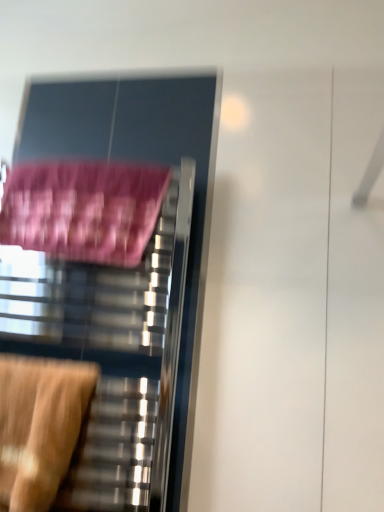
What do you see at coordinates (39, 426) in the screenshot? I see `wooden swivel chair at lower left` at bounding box center [39, 426].

Measure the distance between metallic towel rack at left and camera.

metallic towel rack at left and camera are 98.11 centimeters apart.

In order to click on pink fabric bath towel at left in this screenshot , I will do `click(83, 210)`.

Is wooden swivel chair at lower left not inside pink fabric bath towel at left?

Indeed, wooden swivel chair at lower left is completely outside pink fabric bath towel at left.

Based on the photo, from the image's perspective, is wooden swivel chair at lower left under pink fabric bath towel at left?

Yes.

Where is `bath towel located behind the wooden swivel chair at lower left`? This screenshot has width=384, height=512. bath towel located behind the wooden swivel chair at lower left is located at coordinates coord(83,210).

Considering the sizes of objects pink fabric bath towel at left and metallic towel rack at left in the image provided, who is shorter, pink fabric bath towel at left or metallic towel rack at left?

Standing shorter between the two is pink fabric bath towel at left.

Can you tell me how much pink fabric bath towel at left and metallic towel rack at left differ in facing direction?

pink fabric bath towel at left and metallic towel rack at left are facing 0.000149 degrees away from each other.

Is point (111, 224) in front of point (144, 425)?

Yes, point (111, 224) is in front of point (144, 425).

Based on the photo, is pink fabric bath towel at left in front of or behind metallic towel rack at left in the image?

pink fabric bath towel at left is positioned farther from the viewer than metallic towel rack at left.

How many degrees apart are the facing directions of metallic towel rack at left and pink fabric bath towel at left?

0.000149 degrees separate the facing orientations of metallic towel rack at left and pink fabric bath towel at left.

Based on the photo, considering the relative positions of metallic towel rack at left and pink fabric bath towel at left in the image provided, is metallic towel rack at left behind pink fabric bath towel at left?

No, it is in front of pink fabric bath towel at left.

From the image's perspective, who appears lower, metallic towel rack at left or pink fabric bath towel at left?

metallic towel rack at left is shown below in the image.

From a real-world perspective, is metallic towel rack at left physically above pink fabric bath towel at left?

→ No, from a real-world perspective, metallic towel rack at left is not above pink fabric bath towel at left.

Is wooden swivel chair at lower left oriented away from metallic towel rack at left?

Yes, wooden swivel chair at lower left's orientation is away from metallic towel rack at left.

From a real-world perspective, is wooden swivel chair at lower left over metallic towel rack at left?

No.

Looking at this image, would you say wooden swivel chair at lower left contains metallic towel rack at left?

No, wooden swivel chair at lower left does not contain metallic towel rack at left.

Which of these two, pink fabric bath towel at left or wooden swivel chair at lower left, stands shorter?

With less height is pink fabric bath towel at left.

Is pink fabric bath towel at left wider or thinner than wooden swivel chair at lower left?

pink fabric bath towel at left is thinner than wooden swivel chair at lower left.

Does pink fabric bath towel at left turn towards wooden swivel chair at lower left?

No, pink fabric bath towel at left does not turn towards wooden swivel chair at lower left.

Considering the positions of objects pink fabric bath towel at left and wooden swivel chair at lower left in the image provided, who is more to the left, pink fabric bath towel at left or wooden swivel chair at lower left?

From the viewer's perspective, wooden swivel chair at lower left appears more on the left side.

Identify the location of swivel chair that appears in front of the metallic towel rack at left. This screenshot has height=512, width=384. (39, 426).

Looking at this image, is metallic towel rack at left looking in the opposite direction of wooden swivel chair at lower left?

Correct, metallic towel rack at left is looking away from wooden swivel chair at lower left.

Are metallic towel rack at left and wooden swivel chair at lower left located far from each other?

No, metallic towel rack at left is not far from wooden swivel chair at lower left.

Considering the points (172, 335) and (50, 461), which point is behind, point (172, 335) or point (50, 461)?

Point (172, 335)

Identify the location of swivel chair lying below the pink fabric bath towel at left (from the image's perspective). point(39,426).

Find the location of a particular element. furniture below the pink fabric bath towel at left (from a real-world perspective) is located at coordinates (110, 351).

Estimate the real-world distances between objects in this image. Which object is closer to metallic towel rack at left, pink fabric bath towel at left or wooden swivel chair at lower left?

Based on the image, wooden swivel chair at lower left appears to be nearer to metallic towel rack at left.

Looking at the image, which one is located further to pink fabric bath towel at left, metallic towel rack at left or wooden swivel chair at lower left?

wooden swivel chair at lower left is positioned further to the anchor pink fabric bath towel at left.

From the image, which object appears to be nearer to pink fabric bath towel at left, wooden swivel chair at lower left or metallic towel rack at left?

Among the two, metallic towel rack at left is located nearer to pink fabric bath towel at left.

When comparing their distances from wooden swivel chair at lower left, does pink fabric bath towel at left or metallic towel rack at left seem closer?

metallic towel rack at left.

When comparing their distances from metallic towel rack at left, does wooden swivel chair at lower left or pink fabric bath towel at left seem closer?

wooden swivel chair at lower left.

From the image, which object appears to be nearer to wooden swivel chair at lower left, metallic towel rack at left or pink fabric bath towel at left?

metallic towel rack at left is positioned closer to the anchor wooden swivel chair at lower left.

The image size is (384, 512). Find the location of `furniture between pink fabric bath towel at left and wooden swivel chair at lower left in the vertical direction`. furniture between pink fabric bath towel at left and wooden swivel chair at lower left in the vertical direction is located at coordinates (110, 351).